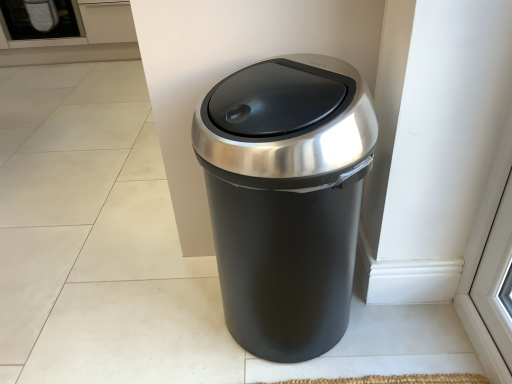
This screenshot has width=512, height=384. Find the location of `vacant region to the right of black matte trash can at center`. vacant region to the right of black matte trash can at center is located at coordinates (393, 333).